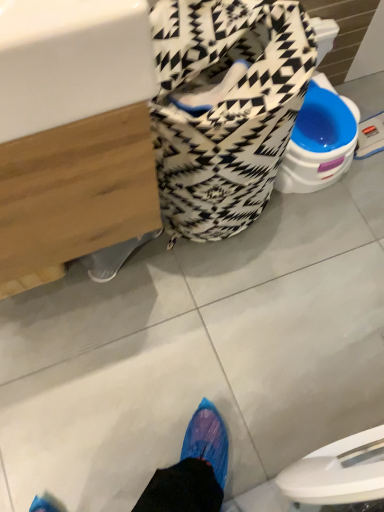
The height and width of the screenshot is (512, 384). In order to click on vacant area that is in front of patterned fabric laundry basket at center in this screenshot , I will do `click(212, 308)`.